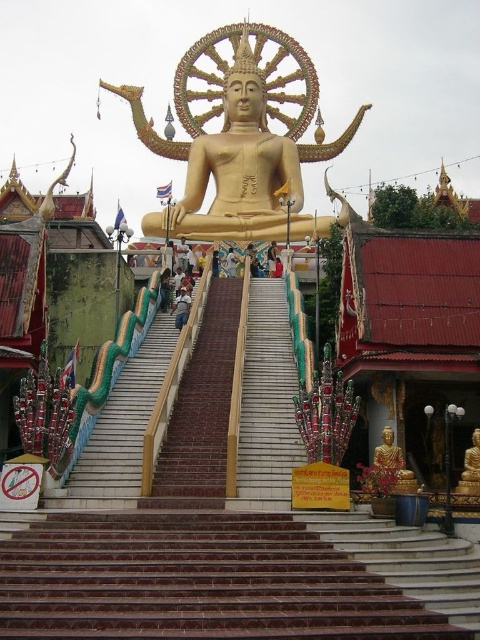
Who is lower down, white marble stairs at center or gold polished statue at center?

white marble stairs at center

In the scene shown: Does white marble stairs at center have a greater width compared to gold polished statue at center?

No.

This screenshot has width=480, height=640. What do you see at coordinates (228, 538) in the screenshot?
I see `white marble stairs at center` at bounding box center [228, 538].

At what (x,y) coordinates should I click in order to perform the action: click on white marble stairs at center. Please return your answer as a coordinate pair (x, y). This screenshot has width=480, height=640. Looking at the image, I should click on (228, 538).